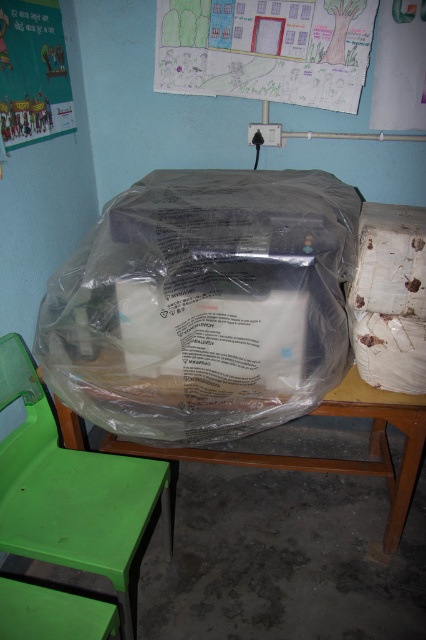
Which is behind, point (58, 541) or point (40, 113)?

Point (40, 113)

Does point (108, 484) lie in front of point (57, 76)?

Yes, point (108, 484) is in front of point (57, 76).

Which is behind, point (126, 593) or point (2, 72)?

The point (2, 72) is more distant.

Identify the location of green plastic chair at lower left. (71, 490).

Is point (273, 339) in front of point (39, 476)?

Yes, it is in front of point (39, 476).

Who is more distant from viewer, (166, 420) or (115, 563)?

Positioned behind is point (166, 420).

Find the location of a particular element. transparent plastic printer at center is located at coordinates (204, 305).

Who is shorter, transparent plastic printer at center or wooden table at center?

wooden table at center

Who is lower down, transparent plastic printer at center or wooden table at center?

Positioned lower is wooden table at center.

The height and width of the screenshot is (640, 426). I want to click on transparent plastic printer at center, so click(204, 305).